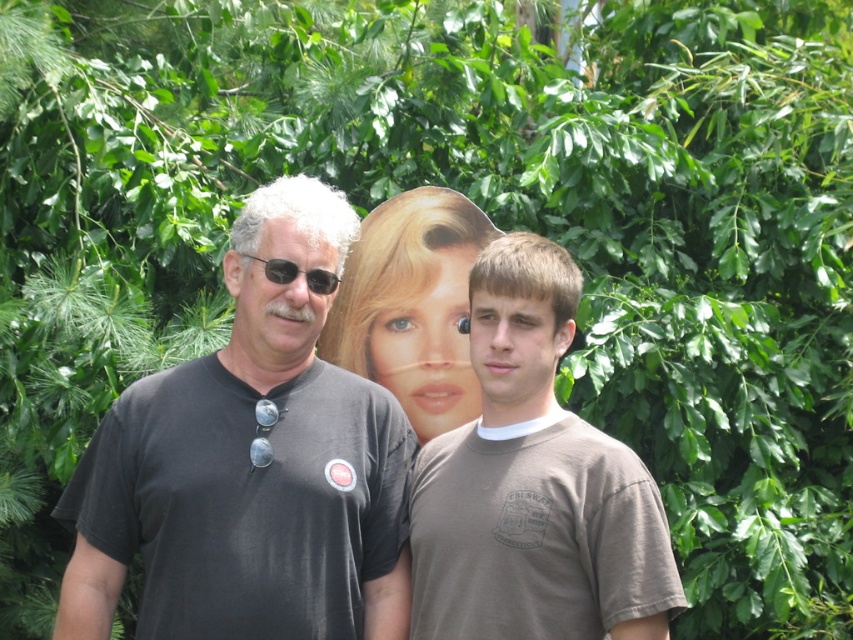
What is the exact coordinate of the smooth plastic poster at center?

The smooth plastic poster at center is located at point (410, 305).